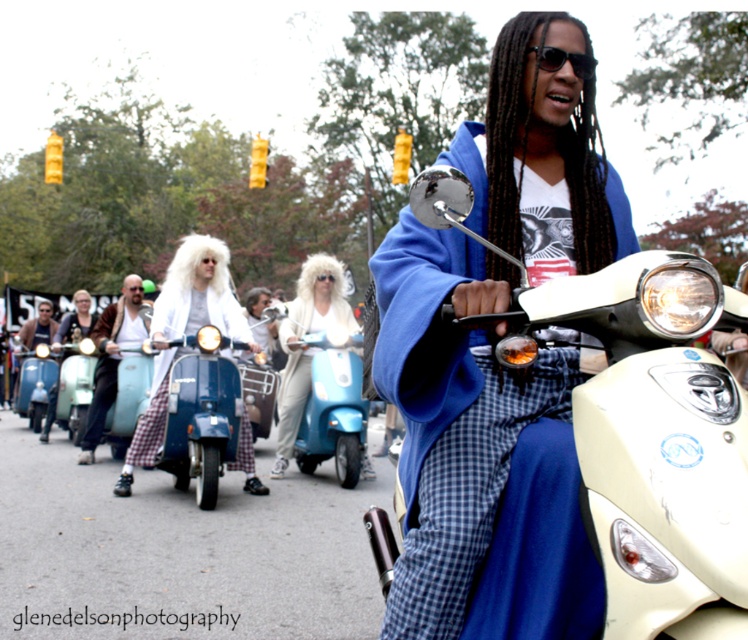
Which is in front, point (211, 403) or point (98, 396)?

Point (211, 403) is more forward.

Who is higher up, blue glossy scooter at center or brown leather jacket at center?

Positioned higher is brown leather jacket at center.

Between point (188, 358) and point (122, 332), which one is positioned behind?

Positioned behind is point (122, 332).

Identify the location of blue glossy scooter at center. The image size is (748, 640). (206, 419).

Between blue fleece jacket at center and matte blue scooter at center, which one is positioned higher?

blue fleece jacket at center is above.

Image resolution: width=748 pixels, height=640 pixels. Describe the element at coordinates (476, 454) in the screenshot. I see `blue fleece jacket at center` at that location.

This screenshot has height=640, width=748. Find the location of `blue fleece jacket at center`. blue fleece jacket at center is located at coordinates (476, 454).

Between point (343, 394) and point (542, 60), which one is positioned behind?

The point (343, 394) is behind.

In order to click on metallic blue scooter at center in this screenshot , I will do `click(334, 406)`.